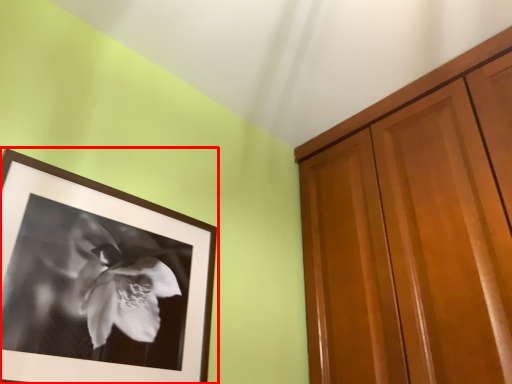
Question: Observing the image, what is the correct spatial positioning of picture frame (annotated by the red box) in reference to cabinetry?

Choices:
 (A) left
 (B) right

Answer: (A)